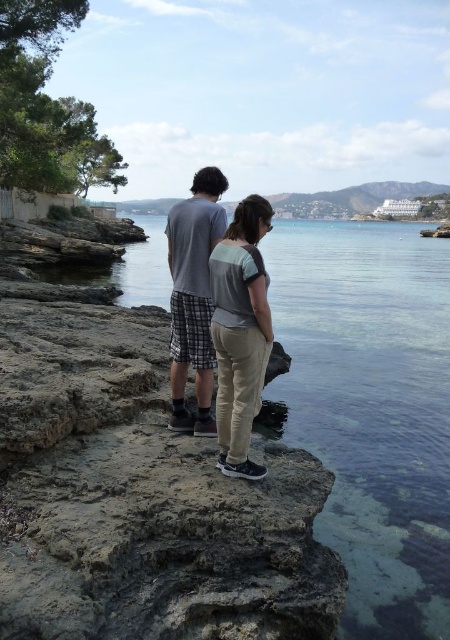
You are standing at the point marked as point (360,554) and want to walk towards the rocky shoreline. The rocky shoreline is 10 meters away from you. Can you safely walk towards it without needing to go around?

The distance between point (360,554) and the viewer is 8.81 meters, which is less than the 10 meters mentioned. Therefore, you can safely walk towards the rocky shoreline without needing to go around.